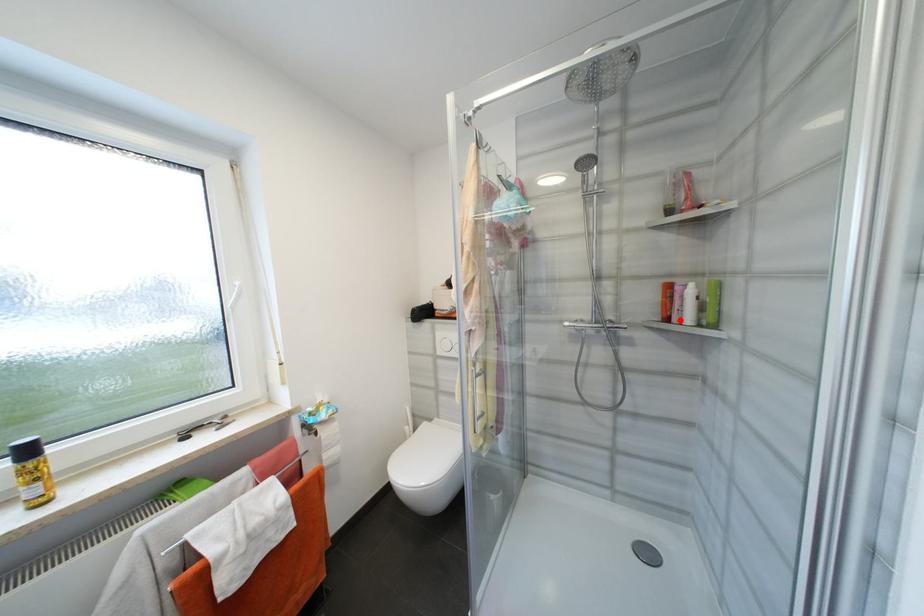
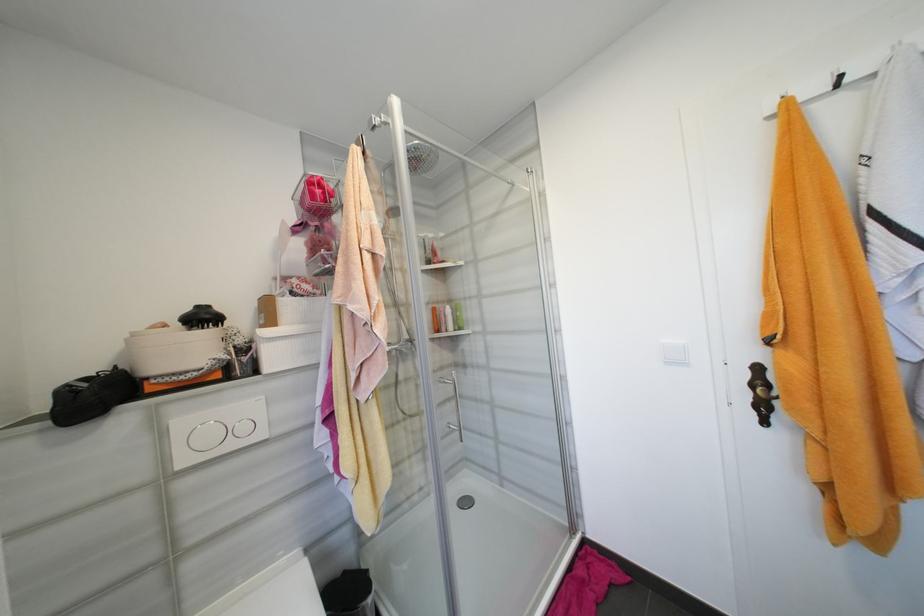
In the second image, find the point that corresponds to the highlighted location in the first image.

(450, 330)